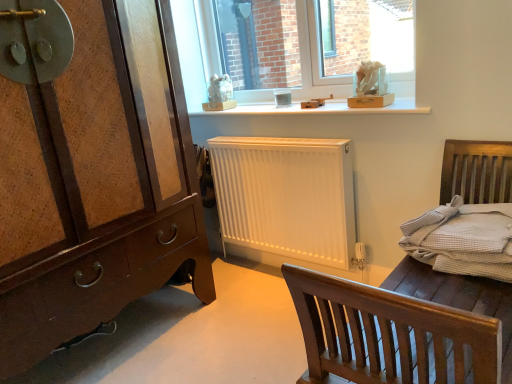
Question: From the image's perspective, is light gray woven bedding at right above or below transparent glass window at upper center?

Choices:
 (A) below
 (B) above

Answer: (A)

Question: Considering their positions, is light gray woven bedding at right located in front of or behind transparent glass window at upper center?

Choices:
 (A) front
 (B) behind

Answer: (A)

Question: Considering the real-world distances, which object is farthest from the transparent glass window at upper center?

Choices:
 (A) brown wood chest of drawers at left
 (B) white matte bed frame at center
 (C) light gray woven bedding at right
 (D) white matte radiator at center
 (E) white wooden shelf at upper center

Answer: (B)

Question: Which is farther from the transparent glass window at upper center?

Choices:
 (A) brown wood chest of drawers at left
 (B) white wooden shelf at upper center
 (C) white matte bed frame at center
 (D) light gray woven bedding at right
 (E) white matte radiator at center

Answer: (C)